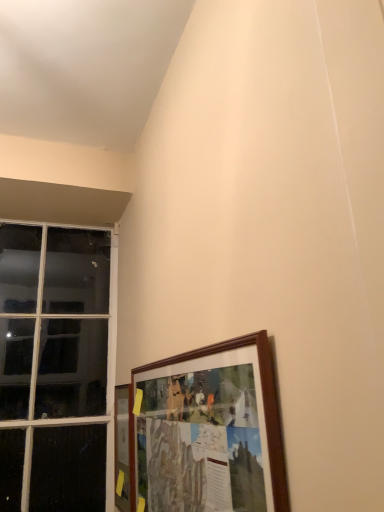
Question: Looking at their shapes, would you say wooden picture frame at lower left, which is the first picture frame in left-to-right order, is wider or thinner than clear glass window at left?

Choices:
 (A) thin
 (B) wide

Answer: (A)

Question: Is wooden picture frame at lower left, which is the first picture frame in left-to-right order, taller or shorter than clear glass window at left?

Choices:
 (A) short
 (B) tall

Answer: (A)

Question: Which of these objects is positioned closest to the wooden frame at lower right, the 1th picture frame viewed from the right?

Choices:
 (A) wooden picture frame at lower left, which is the second picture frame from front to back
 (B) clear glass window at left

Answer: (A)

Question: Which object is the farthest from the wooden picture frame at lower left, which is the second picture frame from front to back?

Choices:
 (A) wooden frame at lower right, positioned as the 1th picture frame in front-to-back order
 (B) clear glass window at left

Answer: (B)